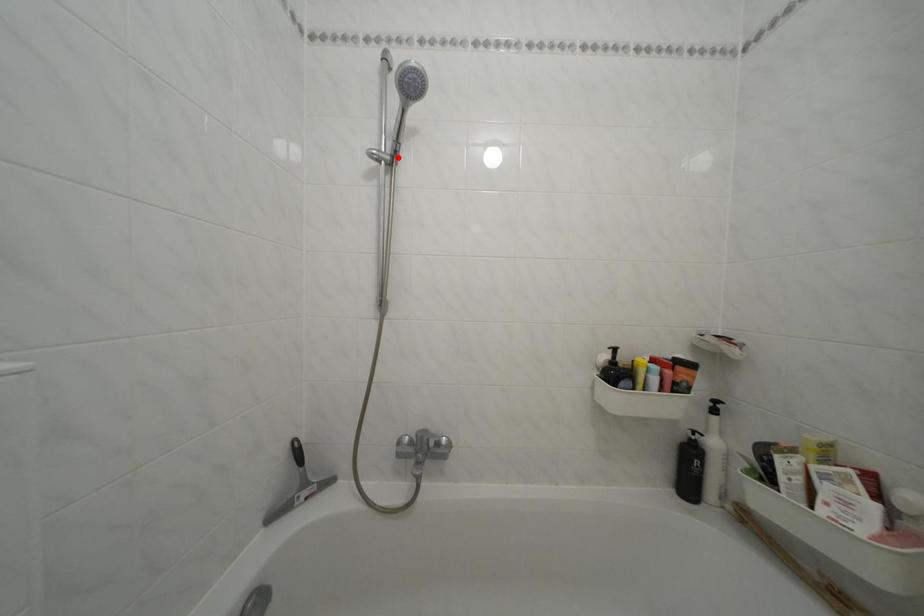
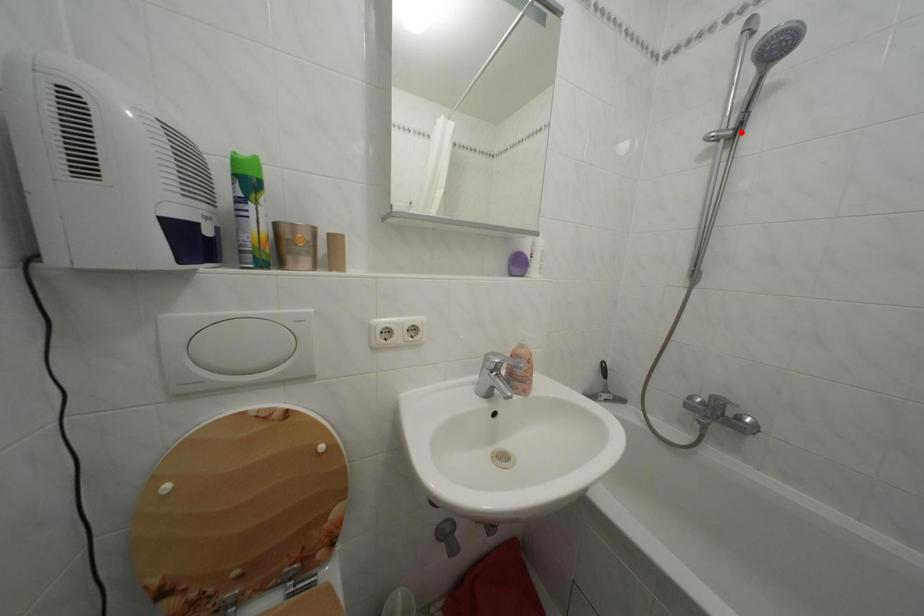
I am providing you with two images of the same scene from different viewpoints. A red point is marked on the first image and another point is marked on the second image. Does the point marked in image1 correspond to the same location as the one in image2?

Yes